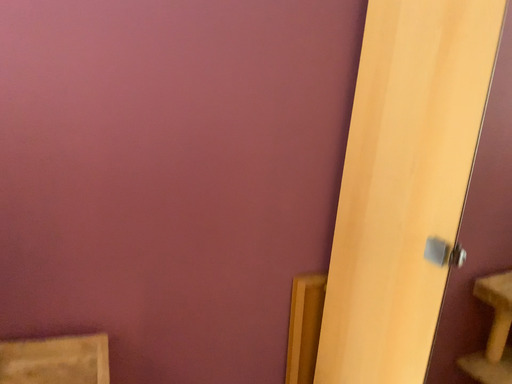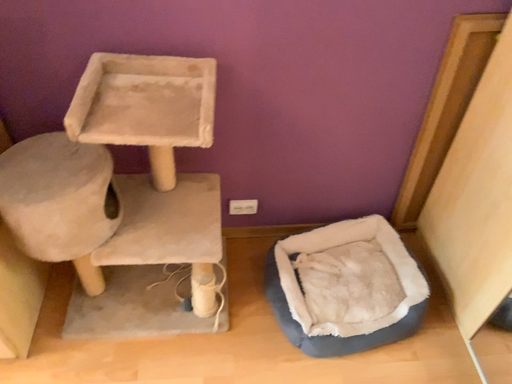
Question: How did the camera likely rotate when shooting the video?

Choices:
 (A) rotated upward
 (B) rotated downward

Answer: (B)